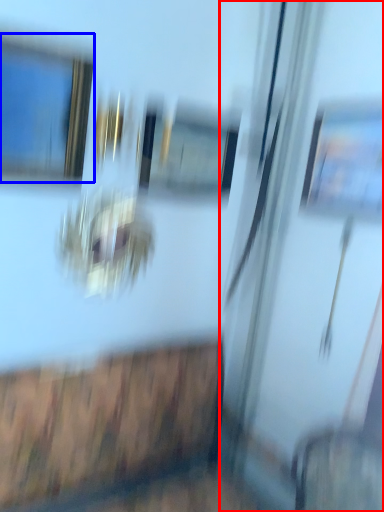
Question: Which object appears farthest to the camera in this image, screen door (highlighted by a red box) or window (highlighted by a blue box)?

Choices:
 (A) screen door
 (B) window

Answer: (A)